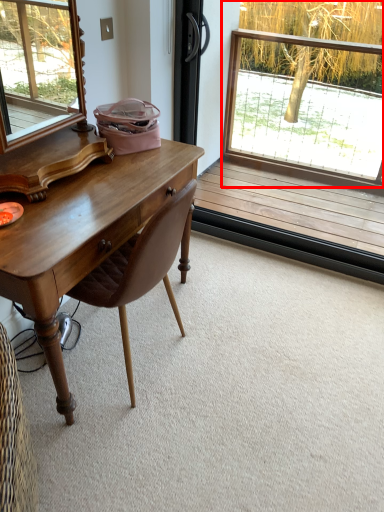
Question: From the image's perspective, where is window (annotated by the red box) located relative to chair?

Choices:
 (A) above
 (B) below

Answer: (A)